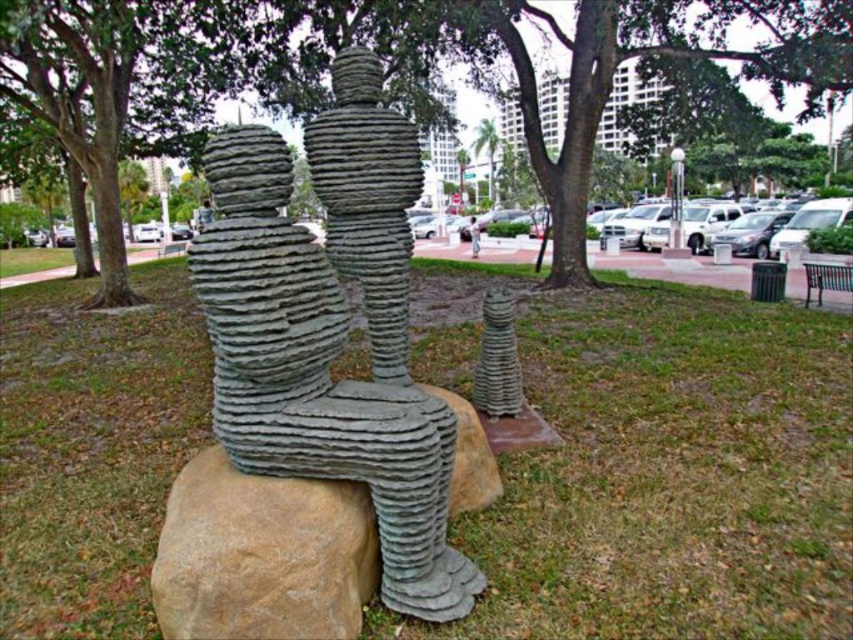
You are a gardener who needs to water both the green grass at center and the green leafy tree at center. Which one should you water first if you want to reach the one closer to the ground first?

The green grass at center is located below the green leafy tree at center, so you should water the green grass at center first since it is closer to the ground.

You are sitting on the light brown wooden bench at center and want to place a small object on the brown rough stone at center. Can you reach it without moving from the bench?

The brown rough stone at center is in front of the light brown wooden bench at center, so you can reach it without moving from the bench.

You are sitting on the light brown wooden bench at center and want to place your bag on the brown rough stone at center. Can you reach it without moving from the bench?

The brown rough stone at center is to the left of light brown wooden bench at center, so you can reach it by extending your arm to the left side of the bench.